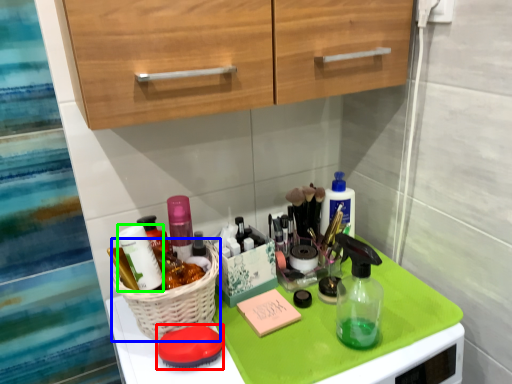
Question: Which object is the farthest from soap (highlighted by a red box)? Choose among these: basket (highlighted by a blue box) or toiletry (highlighted by a green box).

Choices:
 (A) basket
 (B) toiletry

Answer: (B)